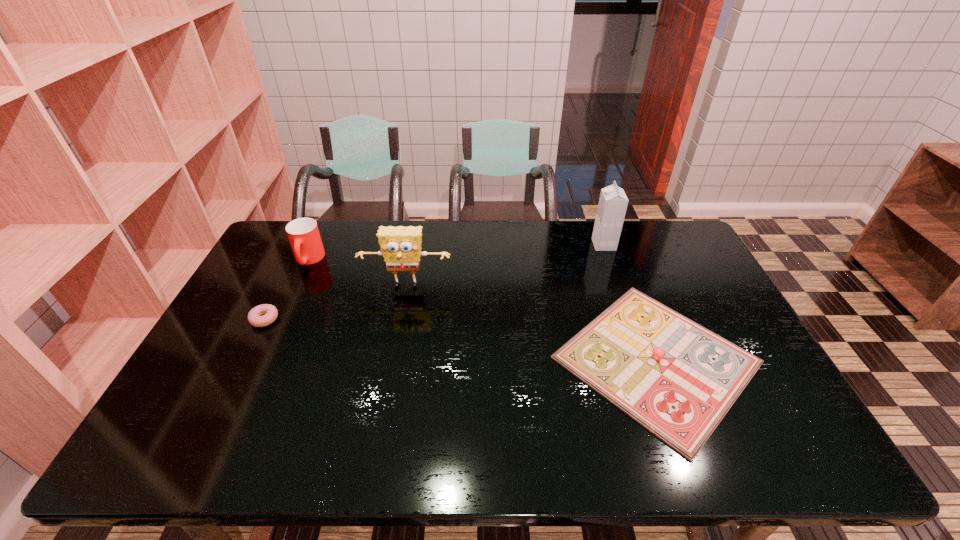
The width and height of the screenshot is (960, 540). I want to click on vacant region at the far edge of the desktop, so click(430, 260).

This screenshot has width=960, height=540. I want to click on free spot at the near edge of the desktop, so click(x=560, y=448).

The width and height of the screenshot is (960, 540). In order to click on vacant space at the left edge of the desktop in this screenshot , I will do `click(237, 339)`.

Find the location of `vacant space at the right edge of the desktop`. vacant space at the right edge of the desktop is located at coordinates (673, 275).

The width and height of the screenshot is (960, 540). What are the coordinates of `vacant space at the near left corner` in the screenshot? It's located at (194, 445).

Where is `empty space between the fourth tallest object and the third object from right to left`? Image resolution: width=960 pixels, height=540 pixels. empty space between the fourth tallest object and the third object from right to left is located at coordinates (531, 323).

This screenshot has height=540, width=960. I want to click on vacant area that lies between the carton and the third object from left to right, so click(505, 266).

Locate an element on the screen. This screenshot has width=960, height=540. unoccupied area between the gameboard and the doughnut is located at coordinates (461, 340).

Where is `unoccupied area between the doughnut and the gameboard`? This screenshot has height=540, width=960. unoccupied area between the doughnut and the gameboard is located at coordinates (461, 340).

Identify the location of vacant area between the gameboard and the sponge. click(x=531, y=323).